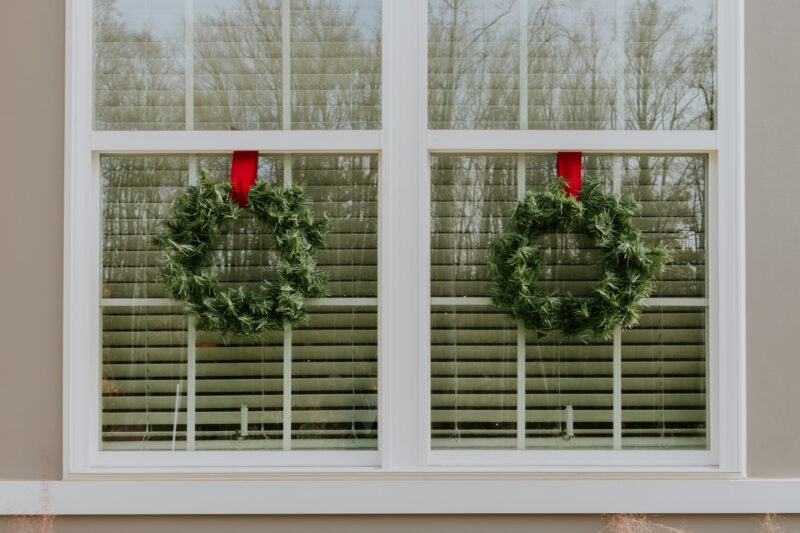
Where is `bottom of left wreath`? The width and height of the screenshot is (800, 533). bottom of left wreath is located at coordinates (248, 332).